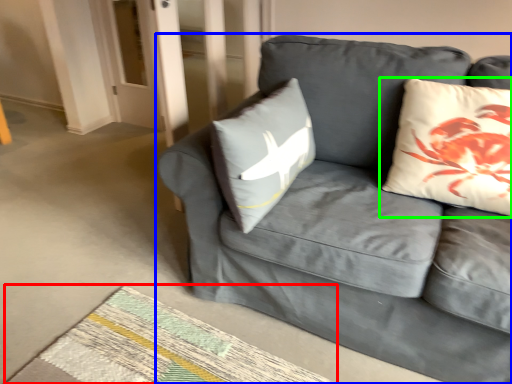
Question: Which object is positioned closest to mat (highlighted by a red box)? Select from studio couch (highlighted by a blue box) and pillow (highlighted by a green box).

Choices:
 (A) studio couch
 (B) pillow

Answer: (A)